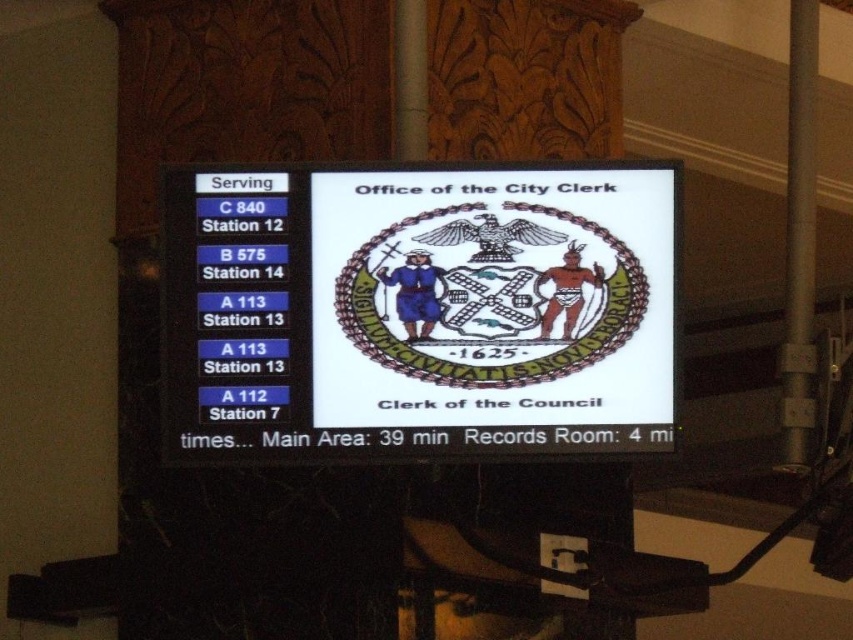
Consider the image. Who is more distant from viewer, (608, 442) or (788, 204)?

Positioned behind is point (788, 204).

Is white glossy scoreboard at center positioned in front of metallic gray pole at right?

Yes.

Is point (651, 292) behind point (792, 369)?

No.

I want to click on white glossy scoreboard at center, so click(416, 310).